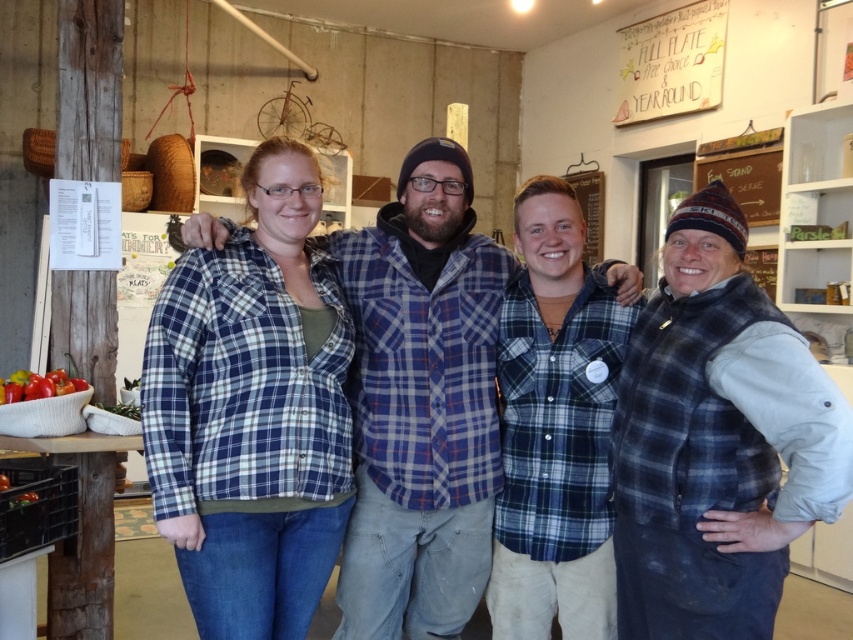
You are a photographer positioned at the back of the room. You want to take a photo that includes both the blue plaid shirt at center and the red glossy tomatoes at lower left. Which object should you adjust your camera focus to first to ensure both are in the frame?

The blue plaid shirt at center is closer to the viewer than the red glossy tomatoes at lower left, so adjust focus to the blue plaid shirt at center first to ensure both are in focus.

You are an interior designer assessing the layout of this rustic space. You need to determine which object, the wooden signboard at upper right or the red glossy tomatoes at lower left, requires more vertical space for proper display. Based on their positions and sizes, which one would you prioritize for height considerations?

The wooden signboard at upper right requires more vertical space as it has a greater height compared to the red glossy tomatoes at lower left.